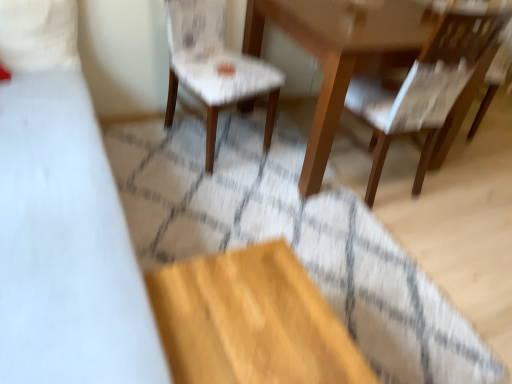
Question: Do you think white fabric chair at center, which is the first chair from left to right, is within wooden chair at right, which ranks as the 1th chair in right-to-left order, or outside of it?

Choices:
 (A) outside
 (B) inside

Answer: (A)

Question: Is white fabric chair at center, which is the first chair from left to right, in front of or behind wooden chair at right, which ranks as the 1th chair in right-to-left order, in the image?

Choices:
 (A) front
 (B) behind

Answer: (B)

Question: Considering the real-world distances, which object is farthest from the matte yellow plywood at lower center?

Choices:
 (A) wooden chair at right, which ranks as the 1th chair in right-to-left order
 (B) wooden table at center
 (C) white fabric bed at left
 (D) white fabric chair at center, acting as the second chair starting from the right

Answer: (A)

Question: Considering the real-world distances, which object is closest to the white fabric chair at center, acting as the second chair starting from the right?

Choices:
 (A) wooden table at center
 (B) white fabric bed at left
 (C) wooden chair at right, marked as the 2th chair in a left-to-right arrangement
 (D) matte yellow plywood at lower center

Answer: (A)